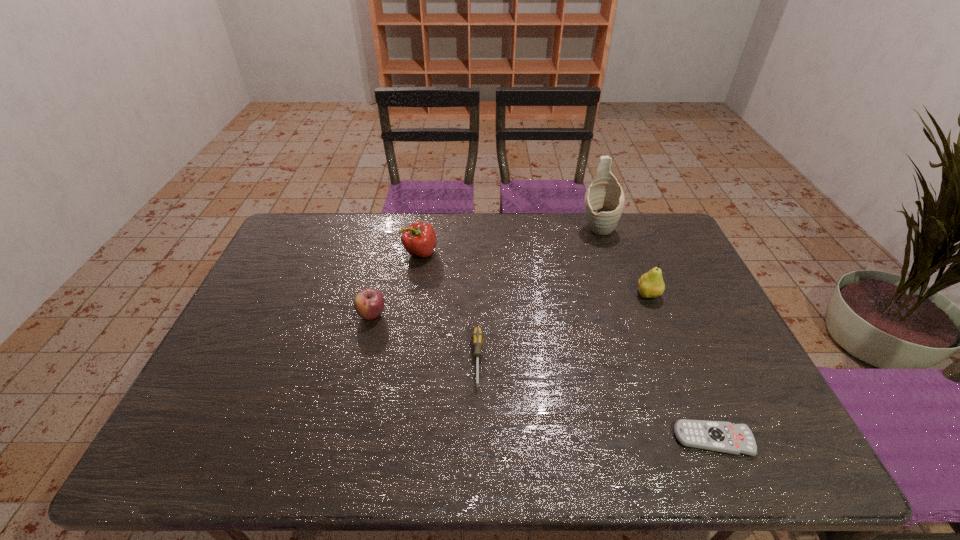
You are a GUI agent. You are given a task and a screenshot of the screen. Output one action in this format:
    pyautogui.click(x=<x>, y=<y>)
    Task: Click on the empty location between the remote control and the apple
    This screenshot has height=540, width=960.
    Given the screenshot: What is the action you would take?
    pyautogui.click(x=542, y=377)

Find the location of a particular element. vacant area that lies between the tallest object and the screwdriver is located at coordinates (538, 294).

Find the location of `free spot between the farthest object and the leftmost object`. free spot between the farthest object and the leftmost object is located at coordinates [485, 272].

Where is `free space between the remote control and the pitcher`? This screenshot has width=960, height=540. free space between the remote control and the pitcher is located at coordinates (656, 334).

Locate an element on the screen. The image size is (960, 540). vacant area that lies between the remote control and the pepper is located at coordinates (566, 346).

Find the location of a particular element. Image resolution: width=960 pixels, height=540 pixels. free space that is in between the pitcher and the remote control is located at coordinates (656, 334).

The height and width of the screenshot is (540, 960). What are the coordinates of `free spot between the third farthest object and the second object from left to right` in the screenshot? It's located at click(535, 274).

Locate an element on the screen. Image resolution: width=960 pixels, height=540 pixels. free space between the farthest object and the pear is located at coordinates (623, 262).

Locate an element on the screen. free space between the fourth nearest object and the remote control is located at coordinates (681, 367).

Identify which object is the third closest to the shortest object. Please provide its 2D coordinates. Your answer should be formatted as a tuple, i.e. [(x, y)], where the tuple contains the x and y coordinates of a point satisfying the conditions above.

[(604, 200)]